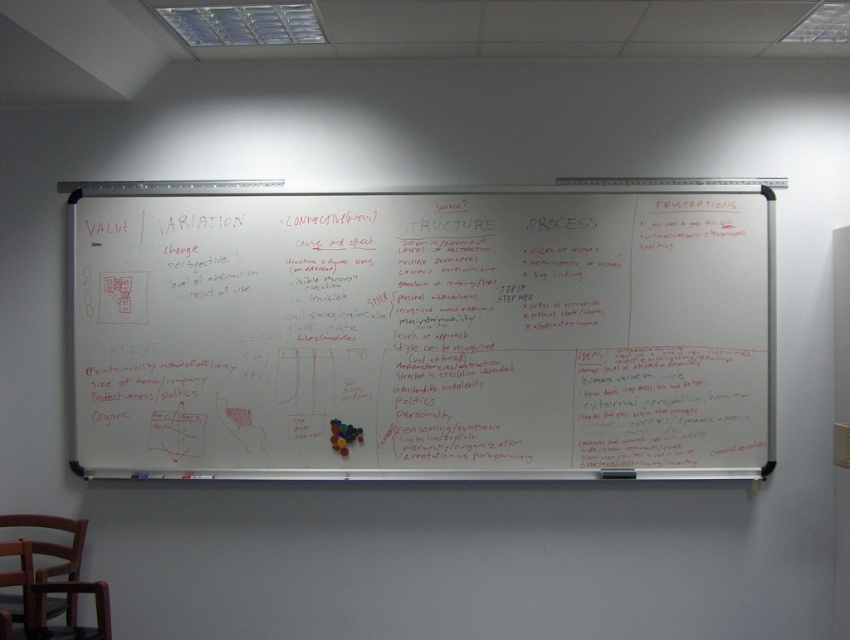
In the scene shown: You are standing in front of the whiteboard and want to touch both points. Which point should you reach for first, point at [724,300] or point at [68,618]?

You should reach for point at [68,618] first because it is closer to you than point at [724,300], which is further away.

You are standing in front of the whiteboard in the classroom. You need to reach a point on the whiteboard marked at coordinates point (654, 310). If your arm can extend 2 meters, can you reach that point without moving closer?

The point (654, 310) is 3.47 meters from the camera. Since your arm can only extend 2 meters, you cannot reach the point without moving closer.